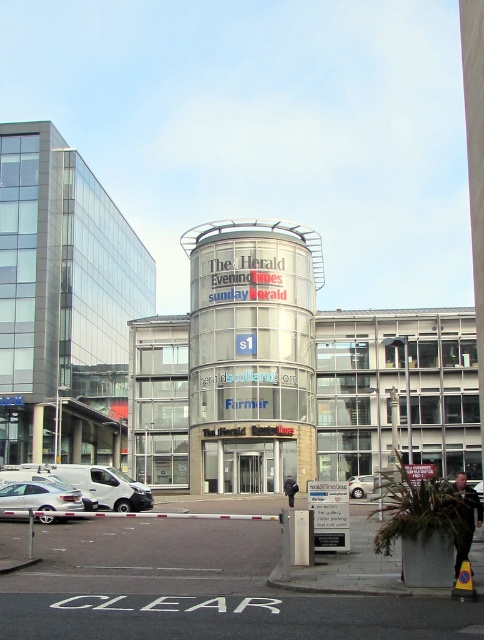
Question: Where is silver metallic car at lower left located in relation to silver metallic car at center in the image?

Choices:
 (A) above
 (B) below

Answer: (A)

Question: Among these objects, which one is farthest from the camera?

Choices:
 (A) silver metallic car at center
 (B) silver metallic car at lower left

Answer: (A)

Question: Does silver metallic sedan at lower left have a greater width compared to silver metallic car at center?

Choices:
 (A) yes
 (B) no

Answer: (B)

Question: Does silver metallic car at lower left have a greater width compared to silver metallic car at center?

Choices:
 (A) no
 (B) yes

Answer: (A)

Question: Estimate the real-world distances between objects in this image. Which object is closer to the silver metallic sedan at lower left?

Choices:
 (A) silver metallic car at lower left
 (B) silver metallic car at center

Answer: (A)

Question: Which object is positioned closest to the silver metallic sedan at lower left?

Choices:
 (A) silver metallic car at center
 (B) silver metallic car at lower left

Answer: (B)